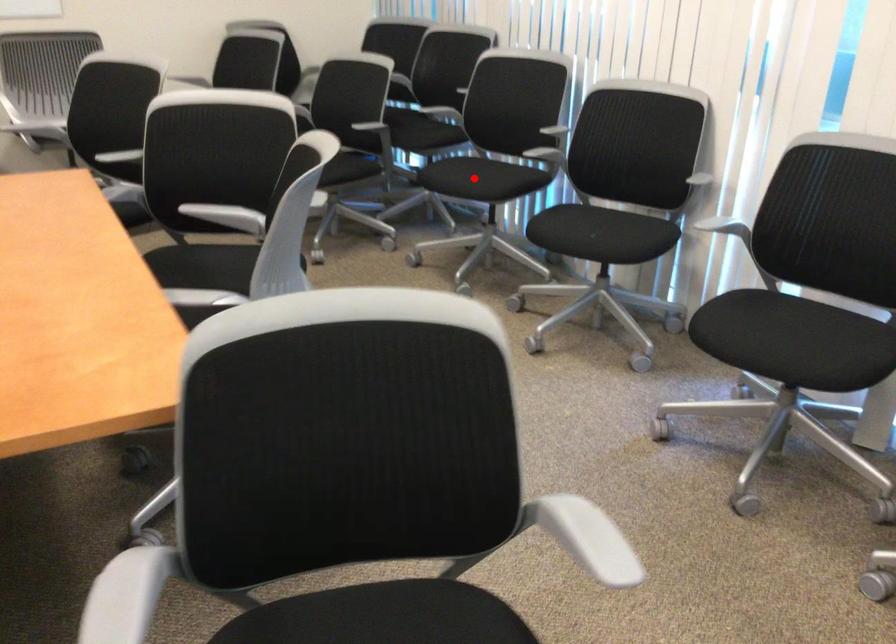
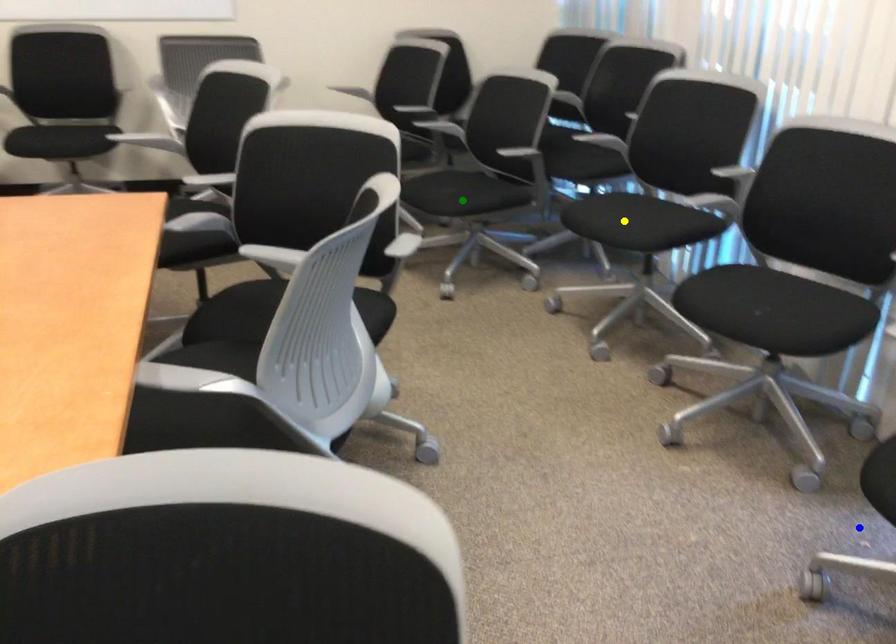
Question: I am providing you with two images of the same scene from different viewpoints. A red point is marked on the first image. You are given multiple points on the second image. Which point in image 2 represents the same 3d spot as the red point in image 1?

Choices:
 (A) blue point
 (B) green point
 (C) yellow point

Answer: (C)